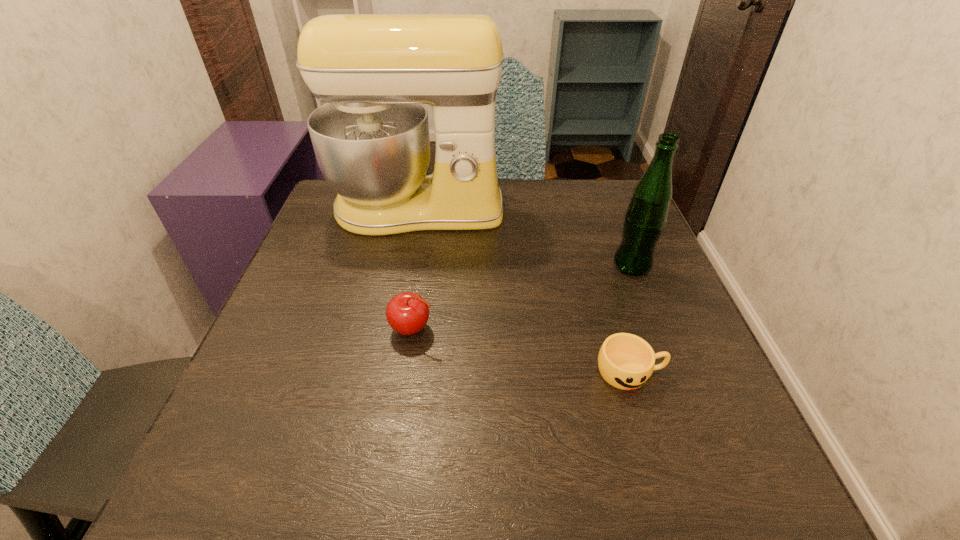
Identify the location of free space between the cup and the beer bottle. (631, 319).

At what (x,y) coordinates should I click in order to perform the action: click on empty space that is in between the third farthest object and the mixer. Please return your answer as a coordinate pair (x, y). Image resolution: width=960 pixels, height=540 pixels. Looking at the image, I should click on (416, 269).

Locate which object ranks in proximity to the third shortest object. Please provide its 2D coordinates. Your answer should be formatted as a tuple, i.e. [(x, y)], where the tuple contains the x and y coordinates of a point satisfying the conditions above.

[(626, 361)]

You are a GUI agent. You are given a task and a screenshot of the screen. Output one action in this format:
    pyautogui.click(x=<x>, y=<y>)
    Task: Click on the object that is the closest to the third farthest object
    
    Given the screenshot: What is the action you would take?
    (371, 139)

Locate an element on the screen. This screenshot has width=960, height=540. vacant position in the image that satisfies the following two spatial constraints: 1. on the side of the second farthest object with the control knob; 2. on the right side of the mixer is located at coordinates (407, 265).

This screenshot has height=540, width=960. In order to click on vacant space that satisfies the following two spatial constraints: 1. on the back side of the second tallest object; 2. on the left side of the cherry in this screenshot , I will do `click(422, 265)`.

Find the location of `vacant space that satisfies the following two spatial constraints: 1. on the side of the third shortest object with the control knob; 2. on the left side of the tallest object`. vacant space that satisfies the following two spatial constraints: 1. on the side of the third shortest object with the control knob; 2. on the left side of the tallest object is located at coordinates (407, 265).

This screenshot has width=960, height=540. What are the coordinates of `free location that satisfies the following two spatial constraints: 1. on the back side of the second nearest object; 2. on the right side of the second tallest object` in the screenshot? It's located at (422, 265).

Where is `free space that satisfies the following two spatial constraints: 1. on the side of the second farthest object with the control knob; 2. on the right side of the mixer`? This screenshot has width=960, height=540. free space that satisfies the following two spatial constraints: 1. on the side of the second farthest object with the control knob; 2. on the right side of the mixer is located at coordinates [x=407, y=265].